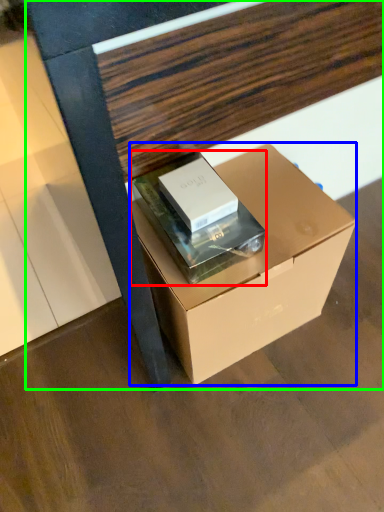
Question: Which is farther away from paperback book (highlighted by a red box)? box (highlighted by a blue box) or furniture (highlighted by a green box)?

Choices:
 (A) box
 (B) furniture

Answer: (B)